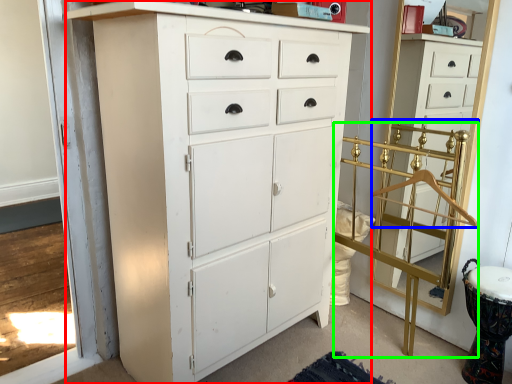
Question: Considering the real-world distances, which object is closest to chest of drawers (highlighted by a red box)? hanger (highlighted by a blue box) or bunk bed (highlighted by a green box).

Choices:
 (A) hanger
 (B) bunk bed

Answer: (B)